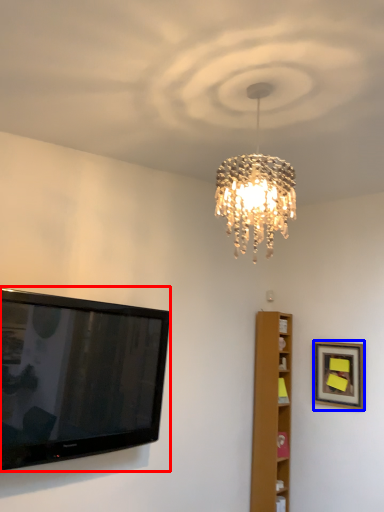
Question: Which object is closer to the camera taking this photo, television (highlighted by a red box) or picture frame (highlighted by a blue box)?

Choices:
 (A) television
 (B) picture frame

Answer: (A)